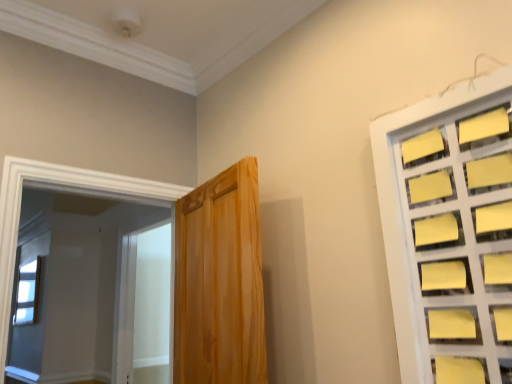
Question: Does clear glass window at upper left, the first window when ordered from left to right, turn towards wooden door at center?

Choices:
 (A) no
 (B) yes

Answer: (A)

Question: Is clear glass window at upper left, which is counted as the 1th window, starting from the back, positioned with its back to wooden door at center?

Choices:
 (A) yes
 (B) no

Answer: (B)

Question: Does clear glass window at upper left, which is counted as the second window, starting from the right, come behind wooden door at center?

Choices:
 (A) yes
 (B) no

Answer: (A)

Question: Can you confirm if clear glass window at upper left, which appears as the 1th window when ordered from the bottom, is bigger than wooden door at center?

Choices:
 (A) yes
 (B) no

Answer: (B)

Question: From a real-world perspective, is clear glass window at upper left, which is counted as the second window, starting from the right, positioned under wooden door at center based on gravity?

Choices:
 (A) no
 (B) yes

Answer: (A)

Question: Based on their sizes in the image, would you say yellow paper at right, the 2th window in the bottom-to-top sequence, is bigger or smaller than white frosted glass screen door at left?

Choices:
 (A) small
 (B) big

Answer: (A)

Question: Is yellow paper at right, the 1th window positioned from the front, wider or thinner than white frosted glass screen door at left?

Choices:
 (A) thin
 (B) wide

Answer: (A)

Question: Considering the positions of point (420, 344) and point (144, 304), is point (420, 344) closer or farther from the camera than point (144, 304)?

Choices:
 (A) farther
 (B) closer

Answer: (B)

Question: Is yellow paper at right, the 2th window in the bottom-to-top sequence, to the left or to the right of white frosted glass screen door at left in the image?

Choices:
 (A) left
 (B) right

Answer: (B)

Question: Considering the positions of wooden door at center and clear glass window at upper left, which is counted as the 1th window, starting from the back, in the image, is wooden door at center taller or shorter than clear glass window at upper left, which is counted as the 1th window, starting from the back,?

Choices:
 (A) tall
 (B) short

Answer: (A)

Question: Choose the correct answer: Is wooden door at center inside clear glass window at upper left, the 2th window when ordered from top to bottom, or outside it?

Choices:
 (A) inside
 (B) outside

Answer: (B)

Question: From the image's perspective, is wooden door at center located above or below clear glass window at upper left, the first window when ordered from left to right?

Choices:
 (A) below
 (B) above

Answer: (B)

Question: Based on their positions, is wooden door at center located to the left or right of clear glass window at upper left, which appears as the 1th window when ordered from the bottom?

Choices:
 (A) left
 (B) right

Answer: (B)

Question: Choose the correct answer: Is white frosted glass screen door at left inside clear glass window at upper left, which is counted as the second window, starting from the right, or outside it?

Choices:
 (A) outside
 (B) inside

Answer: (A)

Question: Is point (169, 301) positioned closer to the camera than point (29, 321)?

Choices:
 (A) closer
 (B) farther

Answer: (B)